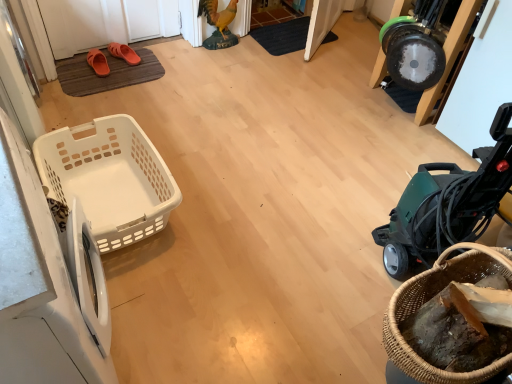
Question: From a real-world perspective, is black textured doormat at center, arranged as the 2th doormat when ordered from the bottom, physically below green plastic vacuum cleaner at right?

Choices:
 (A) yes
 (B) no

Answer: (A)

Question: Can you confirm if black textured doormat at center, arranged as the second doormat when viewed from the left, is wider than green plastic vacuum cleaner at right?

Choices:
 (A) no
 (B) yes

Answer: (A)

Question: Is black textured doormat at center, arranged as the second doormat when viewed from the left, positioned far away from green plastic vacuum cleaner at right?

Choices:
 (A) yes
 (B) no

Answer: (A)

Question: Considering the relative sizes of black textured doormat at center, the 2th doormat positioned from the front, and green plastic vacuum cleaner at right in the image provided, is black textured doormat at center, the 2th doormat positioned from the front, shorter than green plastic vacuum cleaner at right?

Choices:
 (A) no
 (B) yes

Answer: (B)

Question: From the image's perspective, would you say black textured doormat at center, arranged as the second doormat when viewed from the left, is shown under green plastic vacuum cleaner at right?

Choices:
 (A) yes
 (B) no

Answer: (B)

Question: Is black textured doormat at center, which is the first doormat in top-to-bottom order, looking in the opposite direction of green plastic vacuum cleaner at right?

Choices:
 (A) yes
 (B) no

Answer: (B)

Question: Is there a large distance between green plastic vacuum cleaner at right and orange rubber sandals at upper left, acting as the 2th footwear starting from the left?

Choices:
 (A) no
 (B) yes

Answer: (B)

Question: Is green plastic vacuum cleaner at right oriented towards orange rubber sandals at upper left, acting as the 2th footwear starting from the left?

Choices:
 (A) no
 (B) yes

Answer: (A)

Question: Does green plastic vacuum cleaner at right have a larger size compared to orange rubber sandals at upper left, the first footwear from the right?

Choices:
 (A) yes
 (B) no

Answer: (A)

Question: Is green plastic vacuum cleaner at right positioned with its back to orange rubber sandals at upper left, the first footwear from the right?

Choices:
 (A) yes
 (B) no

Answer: (B)

Question: Does green plastic vacuum cleaner at right have a greater width compared to orange rubber sandals at upper left, acting as the 2th footwear starting from the left?

Choices:
 (A) no
 (B) yes

Answer: (B)

Question: From a real-world perspective, is green plastic vacuum cleaner at right on orange rubber sandals at upper left, acting as the 2th footwear starting from the left?

Choices:
 (A) yes
 (B) no

Answer: (A)

Question: Is orange rubber slipper at upper left, placed as the 1th footwear when sorted from left to right, not inside green plastic vacuum cleaner at right?

Choices:
 (A) yes
 (B) no

Answer: (A)